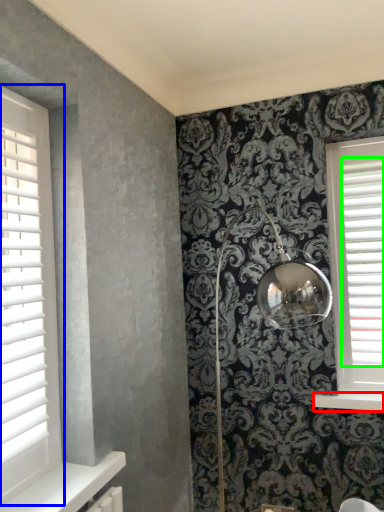
Question: Considering the real-world distances, which object is farthest from window sill (highlighted by a red box)? window (highlighted by a blue box) or blind (highlighted by a green box)?

Choices:
 (A) window
 (B) blind

Answer: (A)